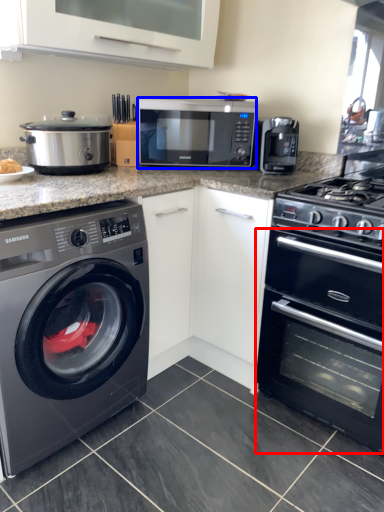
Question: Which object is further to the camera taking this photo, oven (highlighted by a red box) or microwave oven (highlighted by a blue box)?

Choices:
 (A) oven
 (B) microwave oven

Answer: (B)